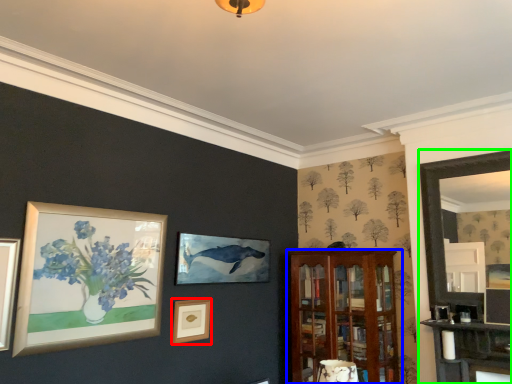
Question: Which object is the farthest from picture frame (highlighted by a red box)? Choose among these: shelf (highlighted by a blue box) or fireplace (highlighted by a green box).

Choices:
 (A) shelf
 (B) fireplace

Answer: (B)